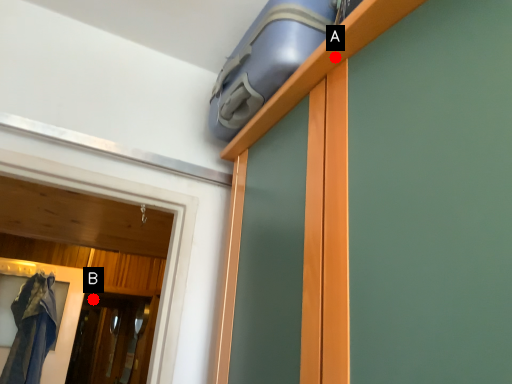
Question: Two points are circled on the image, labeled by A and B beside each circle. Which point is closer to the camera?

Choices:
 (A) A is closer
 (B) B is closer

Answer: (A)